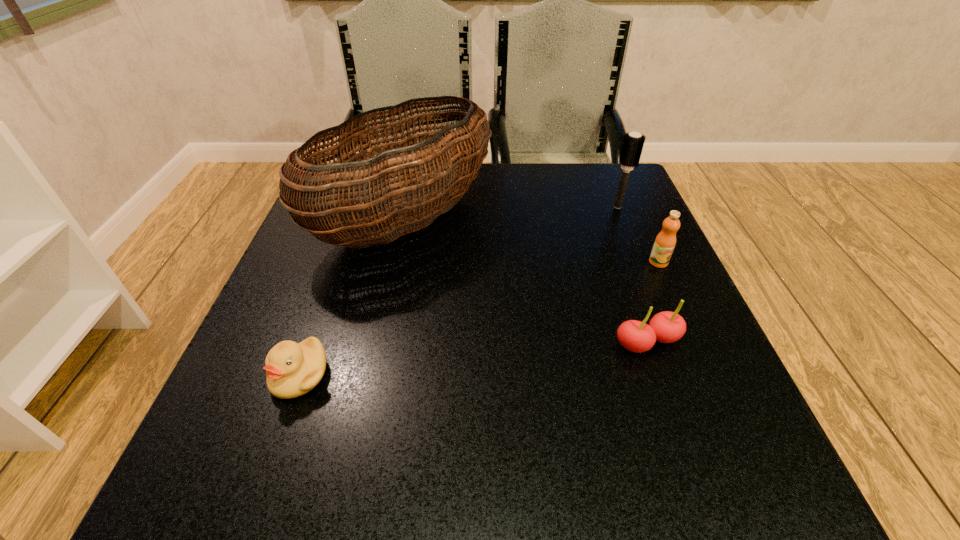
You are a GUI agent. You are given a task and a screenshot of the screen. Output one action in this format:
    pyautogui.click(x=<x>, y=<y>)
    Task: Click on the basket that is at the far edge
    The width and height of the screenshot is (960, 540).
    Given the screenshot: What is the action you would take?
    pyautogui.click(x=312, y=207)

Identify the location of hairbrush that is at the far edge. (633, 143).

This screenshot has height=540, width=960. I want to click on basket located in the left edge section of the desktop, so click(312, 207).

Where is `duckling that is positioned at the left edge`? The image size is (960, 540). duckling that is positioned at the left edge is located at coordinates (292, 369).

Where is `hairbrush that is at the right edge`? The image size is (960, 540). hairbrush that is at the right edge is located at coordinates (633, 143).

Locate an element on the screen. The height and width of the screenshot is (540, 960). orange juice positioned at the right edge is located at coordinates (665, 242).

This screenshot has height=540, width=960. Find the location of `cherry present at the right edge`. cherry present at the right edge is located at coordinates (666, 327).

The height and width of the screenshot is (540, 960). Find the location of `object present at the far left corner`. object present at the far left corner is located at coordinates (312, 207).

The width and height of the screenshot is (960, 540). Find the location of `object present at the far right corner`. object present at the far right corner is located at coordinates (633, 143).

This screenshot has height=540, width=960. In order to click on free spot at the far edge of the desktop in this screenshot , I will do `click(551, 200)`.